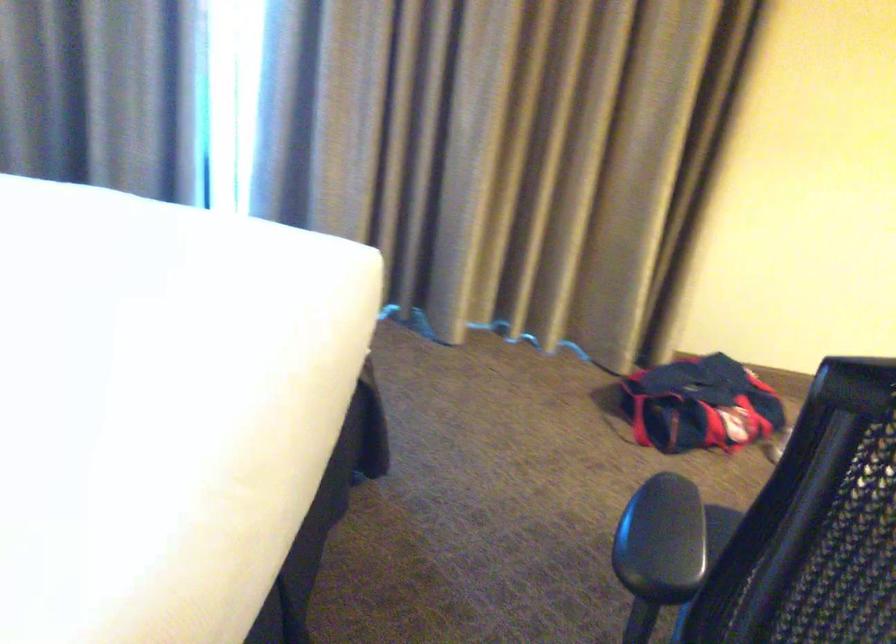
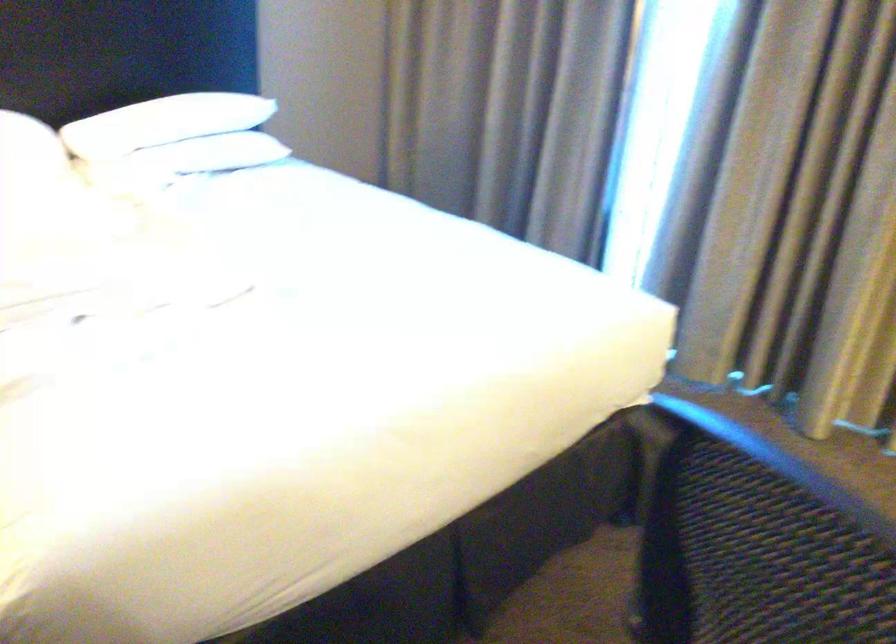
Question: The camera is either moving clockwise (left) or counter-clockwise (right) around the object. The first image is from the beginning of the video and the second image is from the end. Is the camera moving left or right when shooting the video?

Choices:
 (A) Left
 (B) Right

Answer: (B)